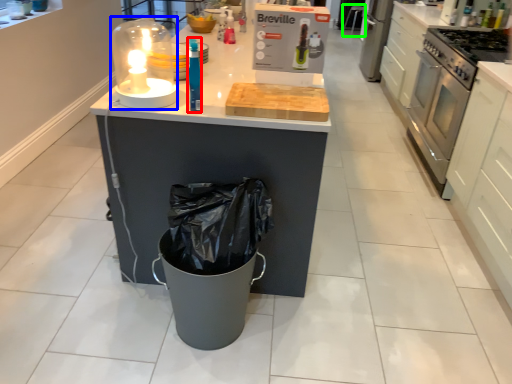
Question: Estimate the real-world distances between objects in this image. Which object is closer to bottle (highlighted by a red box), candle holder (highlighted by a blue box) or bar stool (highlighted by a green box)?

Choices:
 (A) candle holder
 (B) bar stool

Answer: (A)